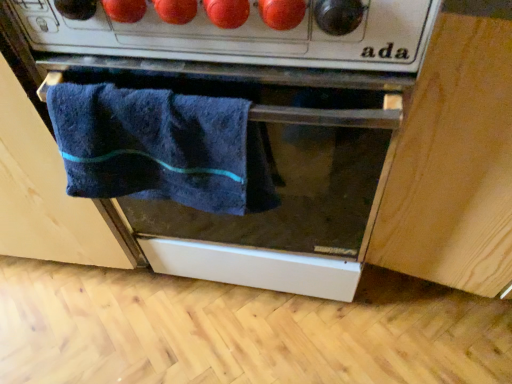
Question: Considering the positions of dark blue towel at center, marked as the first cabinetry in a left-to-right arrangement, and light wood cabinet at lower right, the second cabinetry in the left-to-right sequence, in the image, is dark blue towel at center, marked as the first cabinetry in a left-to-right arrangement, wider or thinner than light wood cabinet at lower right, the second cabinetry in the left-to-right sequence,?

Choices:
 (A) thin
 (B) wide

Answer: (B)

Question: Is point (124, 230) positioned closer to the camera than point (495, 24)?

Choices:
 (A) farther
 (B) closer

Answer: (A)

Question: Which is nearer to the dark blue towel at center, which is the 2th cabinetry in right-to-left order?

Choices:
 (A) light wood cabinet at lower right, the second cabinetry in the left-to-right sequence
 (B) navy blue towel at center
 (C) matte black oven at center

Answer: (C)

Question: Estimate the real-world distances between objects in this image. Which object is closer to the navy blue towel at center?

Choices:
 (A) dark blue towel at center, marked as the first cabinetry in a left-to-right arrangement
 (B) light wood cabinet at lower right, the 1th cabinetry from the right
 (C) matte black oven at center

Answer: (C)